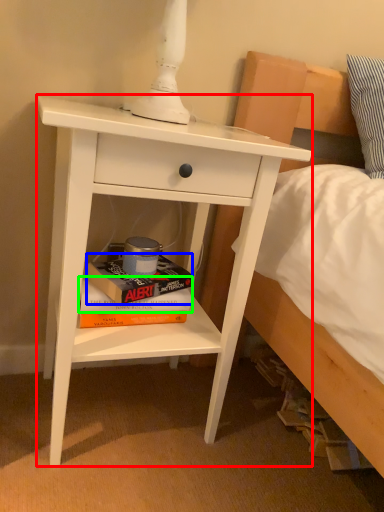
Question: Estimate the real-world distances between objects in this image. Which object is closer to nightstand (highlighted by a red box), paperback book (highlighted by a blue box) or paperback book (highlighted by a green box)?

Choices:
 (A) paperback book
 (B) paperback book

Answer: (A)